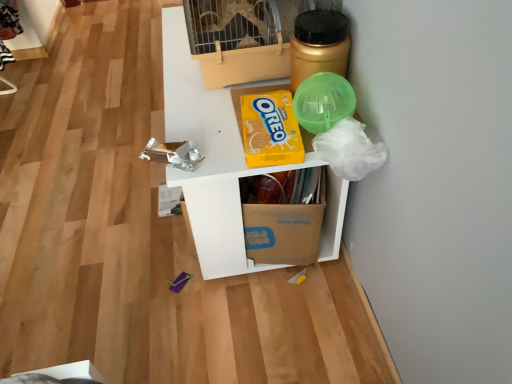
Question: From the image's perspective, is beige plastic birdcage at upper center on top of yellow cardboard oreo at upper center?

Choices:
 (A) no
 (B) yes

Answer: (B)

Question: Does beige plastic birdcage at upper center have a lesser height compared to yellow cardboard oreo at upper center?

Choices:
 (A) no
 (B) yes

Answer: (A)

Question: From a real-world perspective, is beige plastic birdcage at upper center positioned over yellow cardboard oreo at upper center based on gravity?

Choices:
 (A) yes
 (B) no

Answer: (A)

Question: Would you say yellow cardboard oreo at upper center is part of beige plastic birdcage at upper center's contents?

Choices:
 (A) no
 (B) yes

Answer: (A)

Question: Is the depth of beige plastic birdcage at upper center less than that of yellow cardboard oreo at upper center?

Choices:
 (A) no
 (B) yes

Answer: (A)

Question: Is gold metallic jar at upper right spatially inside brown cardboard box at center, or outside of it?

Choices:
 (A) outside
 (B) inside

Answer: (A)

Question: Based on their positions, is gold metallic jar at upper right located to the left or right of brown cardboard box at center?

Choices:
 (A) left
 (B) right

Answer: (B)

Question: Relative to brown cardboard box at center, is gold metallic jar at upper right in front or behind?

Choices:
 (A) behind
 (B) front

Answer: (B)

Question: From their relative heights in the image, would you say gold metallic jar at upper right is taller or shorter than brown cardboard box at center?

Choices:
 (A) short
 (B) tall

Answer: (A)

Question: Considering the positions of gold metallic jar at upper right and yellow cardboard oreo at upper center in the image, is gold metallic jar at upper right wider or thinner than yellow cardboard oreo at upper center?

Choices:
 (A) wide
 (B) thin

Answer: (B)

Question: From the image's perspective, is gold metallic jar at upper right located above or below yellow cardboard oreo at upper center?

Choices:
 (A) below
 (B) above

Answer: (B)

Question: Considering the positions of point (329, 52) and point (259, 94), is point (329, 52) closer or farther from the camera than point (259, 94)?

Choices:
 (A) farther
 (B) closer

Answer: (B)

Question: From a real-world perspective, is gold metallic jar at upper right above or below yellow cardboard oreo at upper center?

Choices:
 (A) below
 (B) above

Answer: (B)

Question: From a real-world perspective, relative to gold metallic jar at upper right, is beige plastic birdcage at upper center vertically above or below?

Choices:
 (A) above
 (B) below

Answer: (A)

Question: Looking at their shapes, would you say beige plastic birdcage at upper center is wider or thinner than gold metallic jar at upper right?

Choices:
 (A) thin
 (B) wide

Answer: (B)